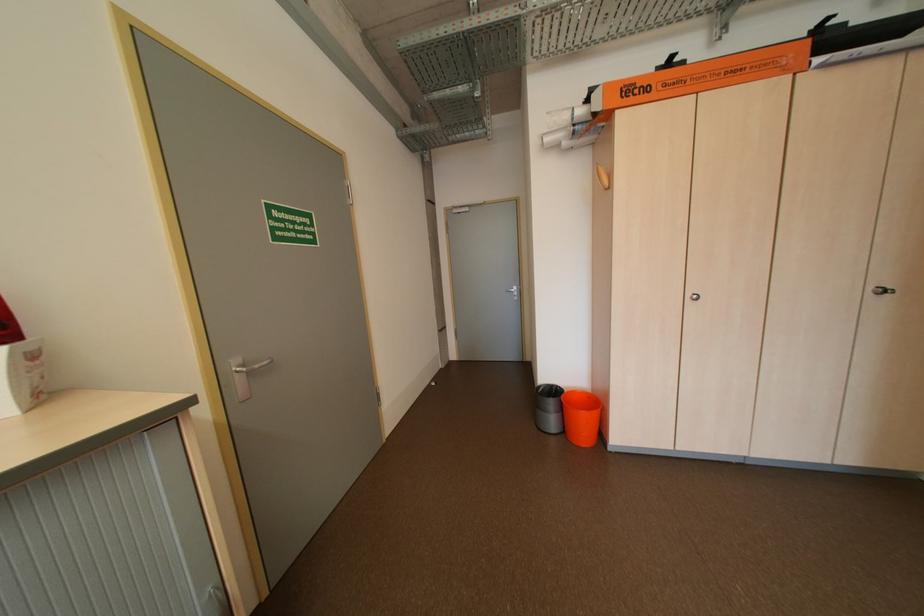
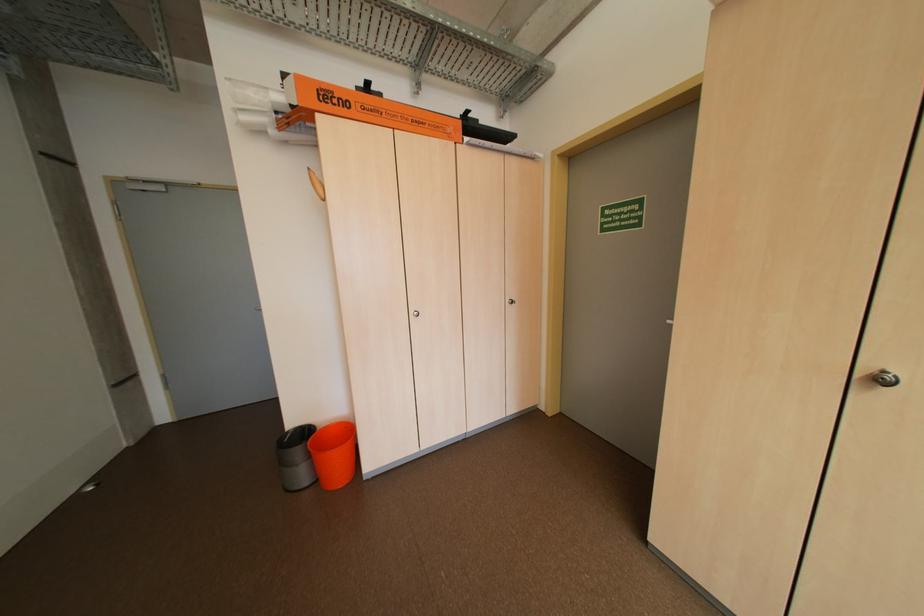
Question: Based on the continuous images, in which direction is the camera rotating? Reply with the corresponding letter.

Choices:
 (A) Left
 (B) Right
 (C) Up
 (D) Down

Answer: (B)